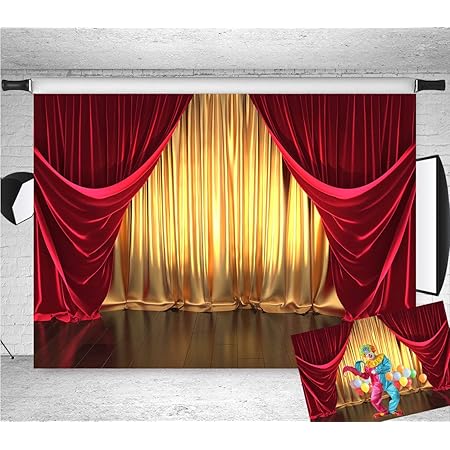
The image size is (450, 450). In order to click on trompe-l'œil in this screenshot , I will do [223, 232].